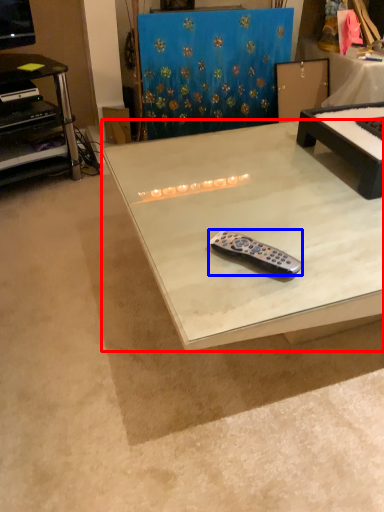
Question: Which of the following is the closest to the observer, table (highlighted by a red box) or remote control (highlighted by a blue box)?

Choices:
 (A) table
 (B) remote control

Answer: (A)